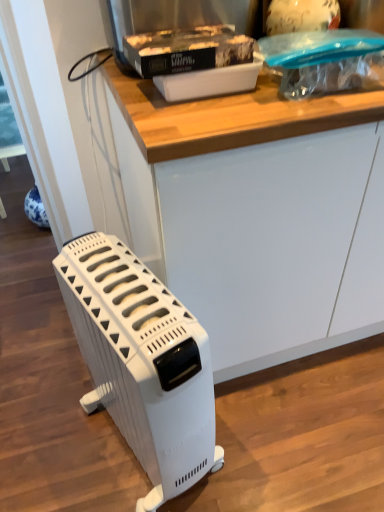
Locate an element on the screen. Image resolution: width=384 pixels, height=512 pixels. empty space that is to the right of white plastic heater at lower left is located at coordinates (261, 433).